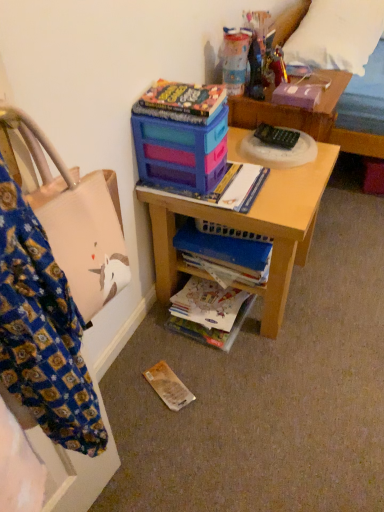
This screenshot has height=512, width=384. In order to click on free location above hardcover book at upper center, which ranks as the 2th paperback book in bottom-to-top order (from a real-world perspective) in this screenshot , I will do `click(167, 86)`.